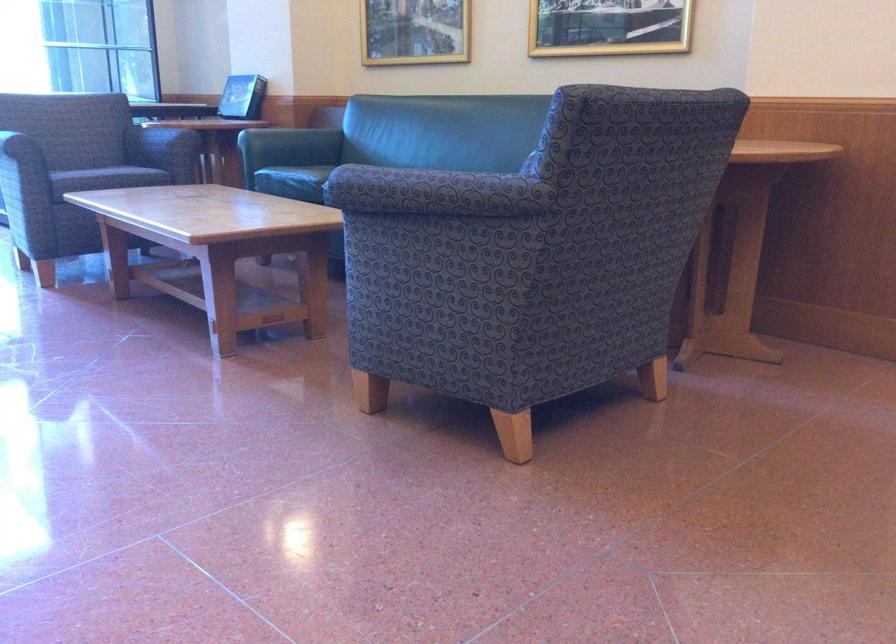
Locate an element on the screen. sofa sitting surface is located at coordinates (293, 182).